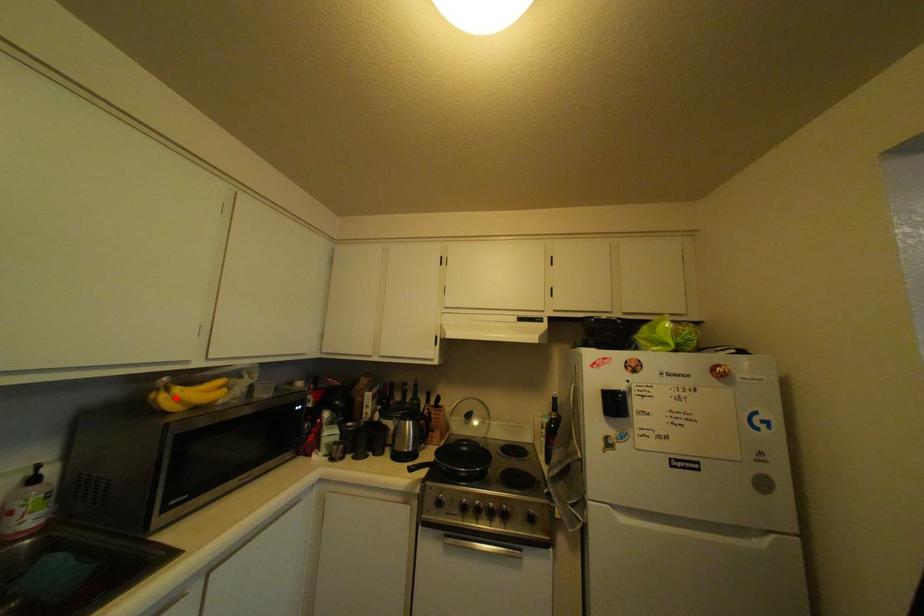
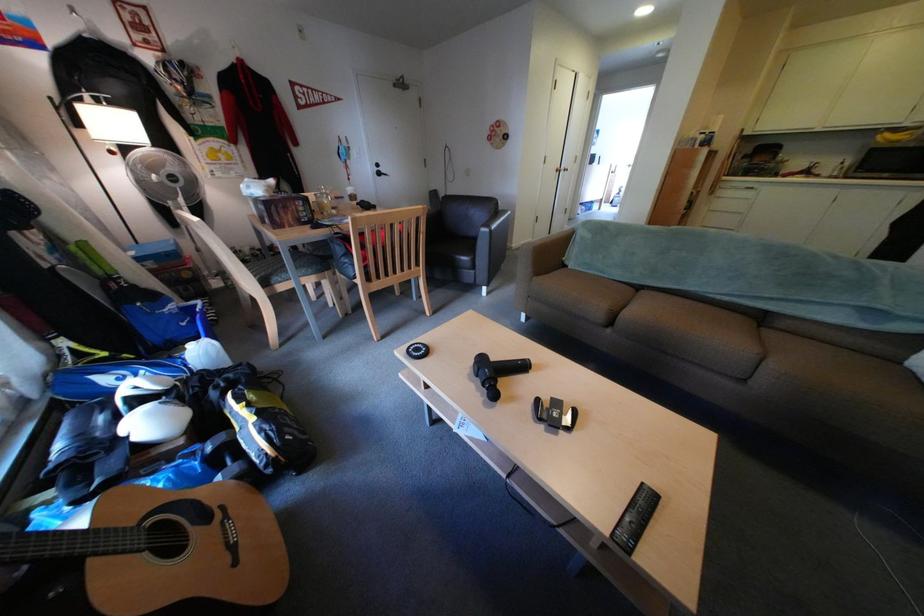
Question: I am providing you with two images of the same scene from different viewpoints. Given a red point in image1, look at the same physical point in image2. Is it:

Choices:
 (A) Closer to the viewpoint
 (B) Farther from the viewpoint

Answer: (B)